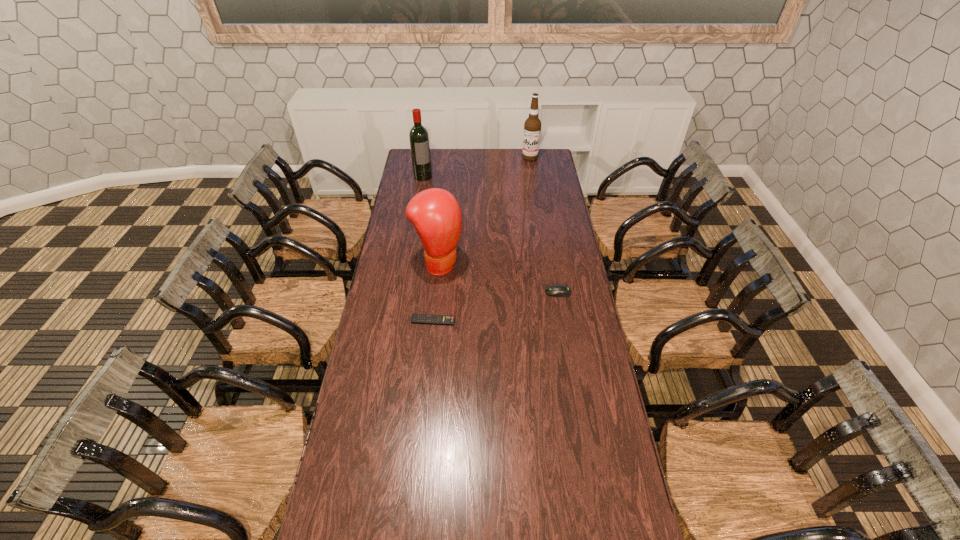
In the image, there is a desktop. What are the coordinates of `free space at the far left corner` in the screenshot? It's located at (409, 166).

In the image, there is a desktop. Where is `vacant space at the far right corner`? vacant space at the far right corner is located at coordinates (549, 152).

Where is `free space between the computer mouse and the alcohol`? free space between the computer mouse and the alcohol is located at coordinates (544, 225).

Identify the location of unoccupied area between the farthest object and the second farthest object. (476, 167).

Identify the location of unoccupied position between the nearest object and the boxing glove. (436, 292).

Where is `unoccupied area between the computer mouse and the remote control`? unoccupied area between the computer mouse and the remote control is located at coordinates (495, 306).

Identify the location of free spot between the alcohol and the wine bottle. The image size is (960, 540). (476, 167).

The height and width of the screenshot is (540, 960). Find the location of `vacant area between the computer mouse and the boxing glove`. vacant area between the computer mouse and the boxing glove is located at coordinates (498, 277).

Image resolution: width=960 pixels, height=540 pixels. Find the location of `free point between the farthest object and the second farthest object`. free point between the farthest object and the second farthest object is located at coordinates (476, 167).

Identify the location of free space between the computer mouse and the alcohol. This screenshot has width=960, height=540. (544, 225).